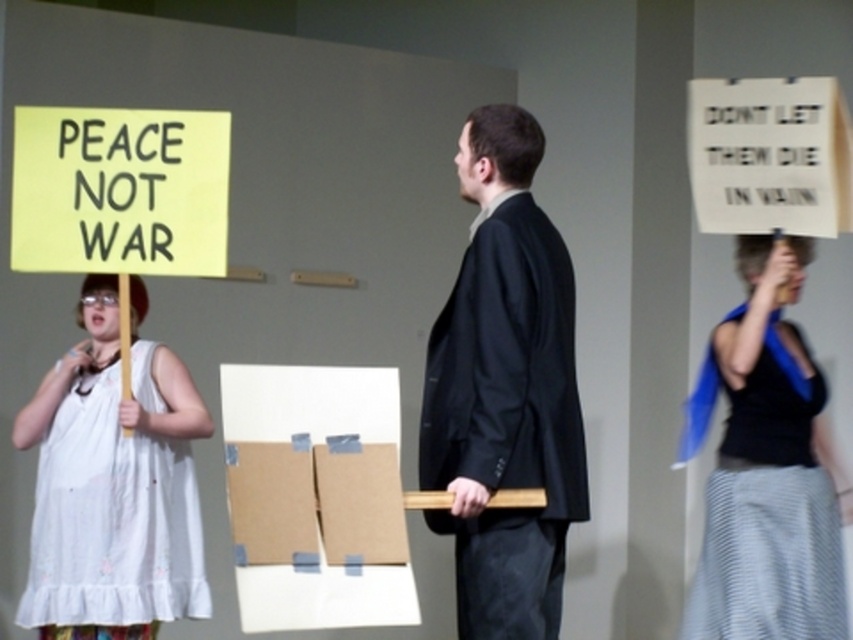
Question: Is black smooth suit at center to the left of white cotton dress at left from the viewer's perspective?

Choices:
 (A) yes
 (B) no

Answer: (B)

Question: Is black smooth suit at center in front of black matte tank top at right?

Choices:
 (A) yes
 (B) no

Answer: (A)

Question: Estimate the real-world distances between objects in this image. Which object is farther from the black smooth suit at center?

Choices:
 (A) black matte tank top at right
 (B) white cotton dress at left
 (C) yellow paper sign at left

Answer: (B)

Question: Which is nearer to the yellow paper sign at left?

Choices:
 (A) white cotton dress at left
 (B) black matte tank top at right
 (C) black smooth suit at center

Answer: (A)

Question: Which object appears farthest from the camera in this image?

Choices:
 (A) black smooth suit at center
 (B) white cotton dress at left
 (C) black matte tank top at right
 (D) yellow paper sign at left

Answer: (C)

Question: Where is black smooth suit at center located in relation to white cotton dress at left in the image?

Choices:
 (A) above
 (B) below

Answer: (A)